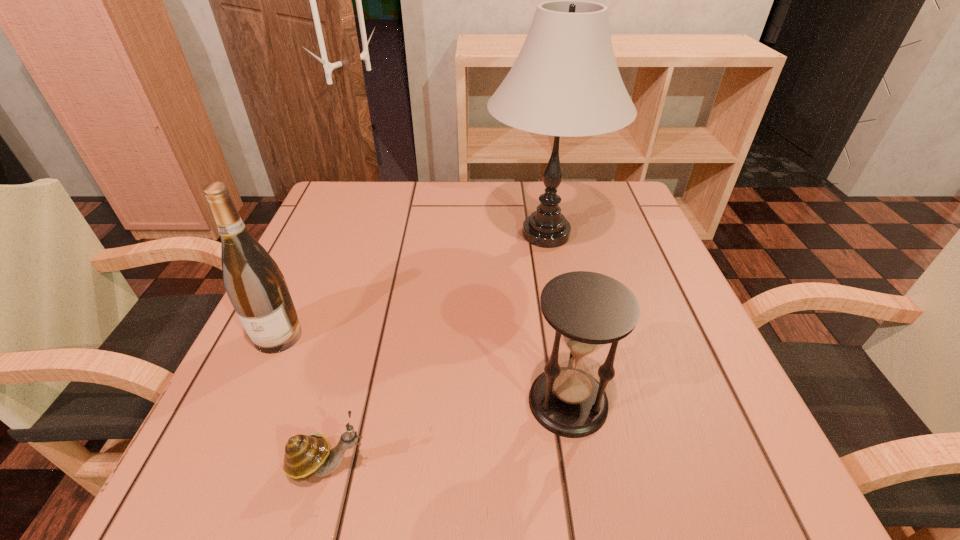
Identify the location of lamp. The width and height of the screenshot is (960, 540). (565, 82).

The height and width of the screenshot is (540, 960). I want to click on the farthest object, so click(565, 82).

This screenshot has height=540, width=960. Find the location of `wine bottle`. wine bottle is located at coordinates (255, 285).

The image size is (960, 540). What are the coordinates of `the third shortest object` in the screenshot? It's located at (255, 285).

Where is `hourglass`? The height and width of the screenshot is (540, 960). hourglass is located at coordinates (587, 310).

Identify the location of the second nearest object. This screenshot has height=540, width=960. (587, 310).

Find the location of a particular element. The height and width of the screenshot is (540, 960). snail is located at coordinates (306, 455).

At what (x,y) coordinates should I click in order to perform the action: click on the third object from right to left. Please return your answer as a coordinate pair (x, y). This screenshot has height=540, width=960. Looking at the image, I should click on (306, 455).

Where is `vacant space positioned on the front of the lamp`? This screenshot has height=540, width=960. vacant space positioned on the front of the lamp is located at coordinates (561, 308).

Find the location of a particular element. The height and width of the screenshot is (540, 960). vacant position located on the label of the leftmost object is located at coordinates pyautogui.click(x=209, y=488).